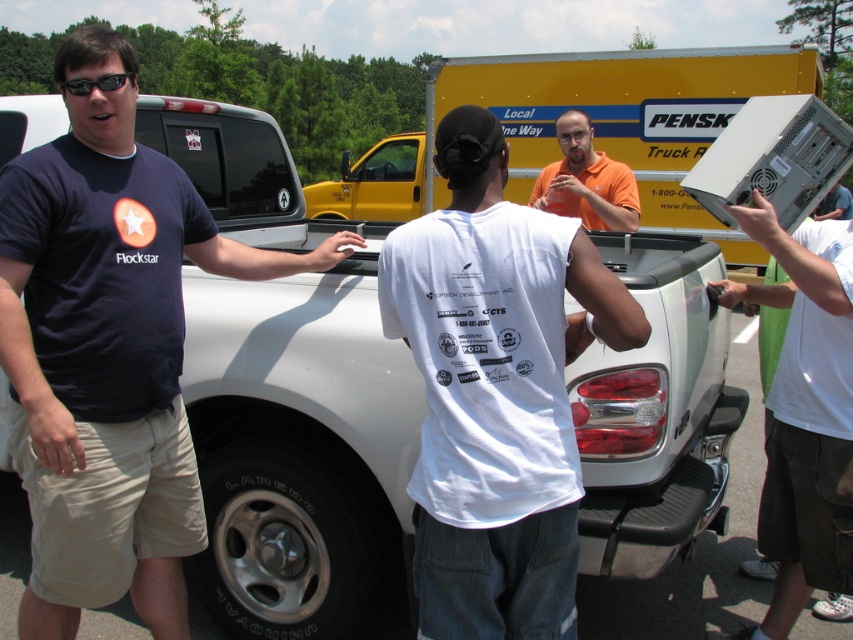
Question: Which point is closer to the camera?

Choices:
 (A) (9, 192)
 (B) (811, 582)
 (C) (624, 332)

Answer: (C)

Question: Is yellow matte trailer truck at upper center thinner than white cotton t-shirt at center?

Choices:
 (A) no
 (B) yes

Answer: (A)

Question: Is white cotton t-shirt at center above black plastic sunglasses at upper left?

Choices:
 (A) yes
 (B) no

Answer: (B)

Question: Can you confirm if yellow matte trailer truck at upper center is wider than orange matte shirt at center?

Choices:
 (A) no
 (B) yes

Answer: (B)

Question: Which point is farther to the camera?

Choices:
 (A) (497, 632)
 (B) (105, 83)

Answer: (B)

Question: Which of the following is the farthest from the observer?

Choices:
 (A) black plastic sunglasses at upper left
 (B) yellow matte trailer truck at upper center

Answer: (B)